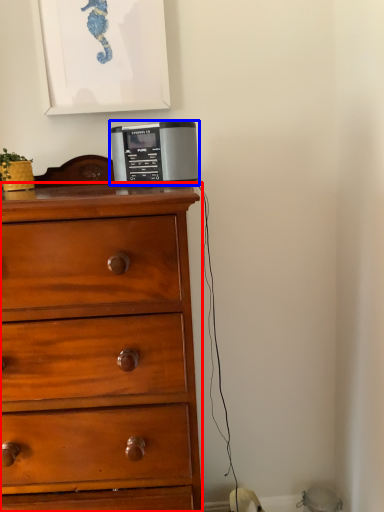
Question: Which point is further to the camera, chest of drawers (highlighted by a red box) or home appliance (highlighted by a blue box)?

Choices:
 (A) chest of drawers
 (B) home appliance

Answer: (B)